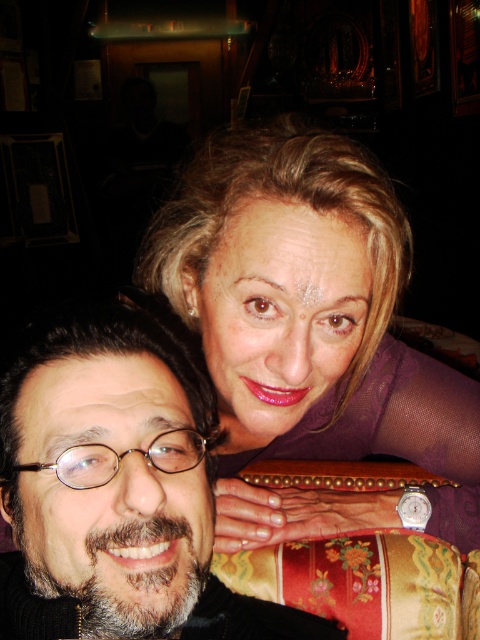
Question: Which point is closer to the camera?

Choices:
 (A) matte purple blouse at upper right
 (B) smooth black hair at center

Answer: (B)

Question: Does matte purple blouse at upper right appear on the left side of smooth black hair at center?

Choices:
 (A) no
 (B) yes

Answer: (A)

Question: Can you confirm if matte purple blouse at upper right is wider than smooth black hair at center?

Choices:
 (A) no
 (B) yes

Answer: (B)

Question: Which point appears closest to the camera in this image?

Choices:
 (A) [41, 541]
 (B) [233, 364]

Answer: (A)

Question: Does matte purple blouse at upper right appear under smooth black hair at center?

Choices:
 (A) no
 (B) yes

Answer: (A)